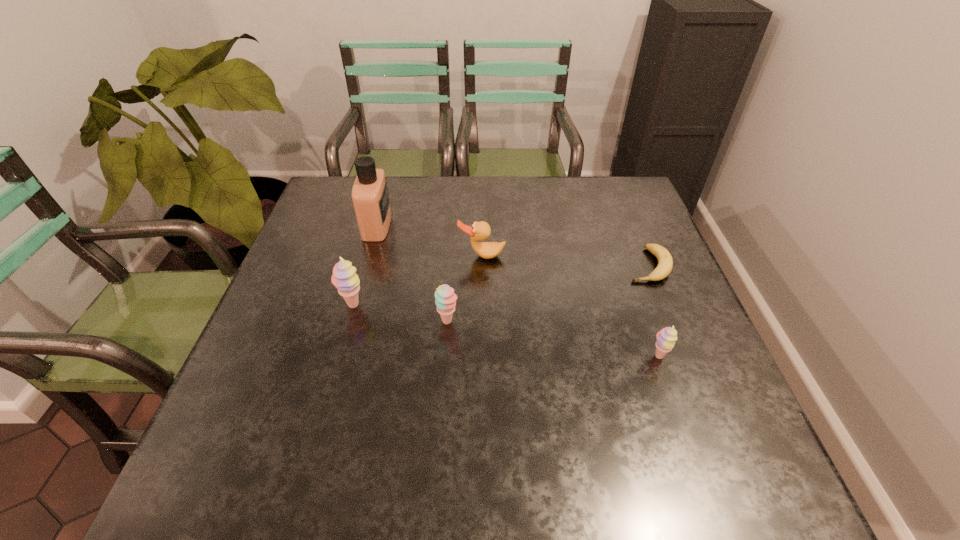
The height and width of the screenshot is (540, 960). I want to click on free space between the shortest object and the nearest object, so click(653, 311).

Locate an element on the screen. This screenshot has width=960, height=540. empty space that is in between the duck and the fifth shortest object is located at coordinates (418, 281).

Find the location of `unoccupied position between the second sherbert from left to right and the duck`. unoccupied position between the second sherbert from left to right and the duck is located at coordinates (465, 288).

You are a GUI agent. You are given a task and a screenshot of the screen. Output one action in this format:
    pyautogui.click(x=<x>, y=<y>)
    Task: Click on the vacant region between the farthest object and the second tallest object
    This screenshot has height=540, width=960.
    Given the screenshot: What is the action you would take?
    pyautogui.click(x=365, y=266)

Find the location of a particular element. free space that is in between the duck and the farthest object is located at coordinates (429, 241).

Locate which object ranks fourth in proximity to the second shortest sherbert. Please provide its 2D coordinates. Your answer should be formatted as a tuple, i.e. [(x, y)], where the tuple contains the x and y coordinates of a point satisfying the conditions above.

[(666, 338)]

The height and width of the screenshot is (540, 960). What are the coordinates of `the third closest object to the leftmost sherbert` in the screenshot? It's located at (479, 231).

I want to click on the second closest sherbert to the shortest object, so click(x=445, y=298).

This screenshot has width=960, height=540. I want to click on sherbert that is the closest to the nearest object, so click(x=445, y=298).

Locate an element on the screen. The width and height of the screenshot is (960, 540). free point that satisfies the following two spatial constraints: 1. on the beak of the shortest sherbert; 2. on the left side of the duck is located at coordinates (482, 357).